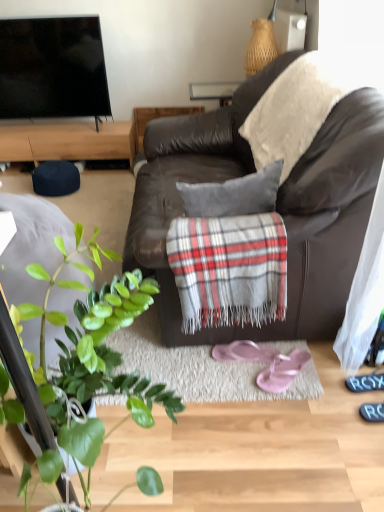
Question: Is green leafy plant at lower left completely or partially inside flat screen tv at upper left?

Choices:
 (A) yes
 (B) no

Answer: (B)

Question: Can you confirm if flat screen tv at upper left is thinner than green leafy plant at lower left?

Choices:
 (A) yes
 (B) no

Answer: (A)

Question: From the image's perspective, does flat screen tv at upper left appear higher than green leafy plant at lower left?

Choices:
 (A) no
 (B) yes

Answer: (B)

Question: From the image's perspective, is flat screen tv at upper left beneath green leafy plant at lower left?

Choices:
 (A) no
 (B) yes

Answer: (A)

Question: Does flat screen tv at upper left lie behind green leafy plant at lower left?

Choices:
 (A) no
 (B) yes

Answer: (B)

Question: Is the position of flat screen tv at upper left less distant than that of green leafy plant at lower left?

Choices:
 (A) yes
 (B) no

Answer: (B)

Question: Does flat screen tv at upper left have a greater height compared to brown leather couch at center?

Choices:
 (A) yes
 (B) no

Answer: (B)

Question: Is brown leather couch at center a part of flat screen tv at upper left?

Choices:
 (A) no
 (B) yes

Answer: (A)

Question: Are flat screen tv at upper left and brown leather couch at center far apart?

Choices:
 (A) yes
 (B) no

Answer: (A)

Question: Considering the relative sizes of flat screen tv at upper left and brown leather couch at center in the image provided, is flat screen tv at upper left shorter than brown leather couch at center?

Choices:
 (A) yes
 (B) no

Answer: (A)

Question: From a real-world perspective, is flat screen tv at upper left located beneath brown leather couch at center?

Choices:
 (A) yes
 (B) no

Answer: (B)

Question: From the image's perspective, is flat screen tv at upper left on brown leather couch at center?

Choices:
 (A) yes
 (B) no

Answer: (A)

Question: Can you confirm if plaid woolen blanket at upper right is wider than black rubber shoe at lower right?

Choices:
 (A) yes
 (B) no

Answer: (A)